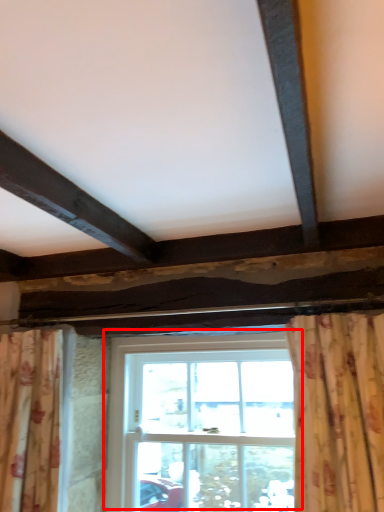
Question: Where is window (annotated by the red box) located in relation to curtain in the image?

Choices:
 (A) left
 (B) right

Answer: (B)